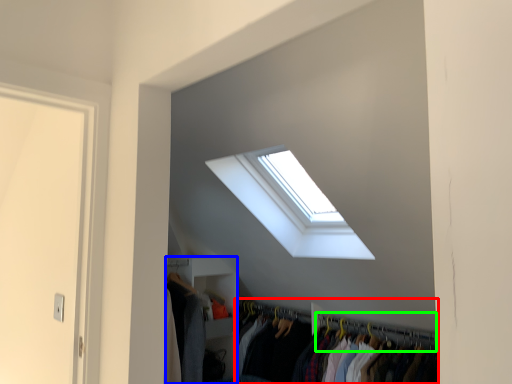
Question: Which is farther away from closet (highlighted by a red box)? closet (highlighted by a blue box) or hanger (highlighted by a green box)?

Choices:
 (A) closet
 (B) hanger

Answer: (A)